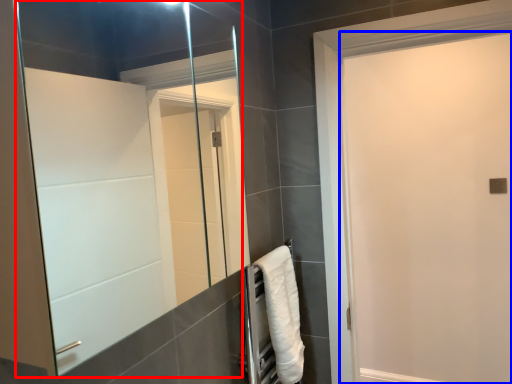
Question: Which point is closer to the camera, mirror (highlighted by a red box) or screen door (highlighted by a blue box)?

Choices:
 (A) mirror
 (B) screen door

Answer: (A)